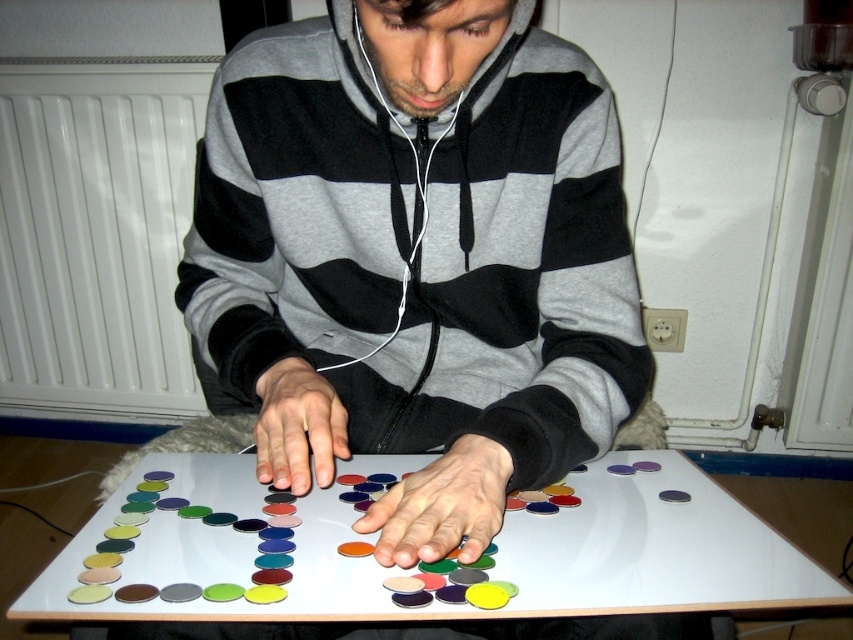
Question: Can you confirm if white glossy table at center is smaller than white matte radiator at left?

Choices:
 (A) yes
 (B) no

Answer: (A)

Question: Which of the following is the closest to the observer?

Choices:
 (A) matte plastic hands at center
 (B) matte plastic coins at center
 (C) matte plastic hand at center

Answer: (A)

Question: Is white glossy table at center smaller than matte plastic hand at center?

Choices:
 (A) yes
 (B) no

Answer: (B)

Question: Can you confirm if white glossy table at center is positioned above white matte radiator at left?

Choices:
 (A) yes
 (B) no

Answer: (B)

Question: Considering the real-world distances, which object is closest to the white glossy table at center?

Choices:
 (A) matte plastic hand at center
 (B) matte plastic coins at center

Answer: (B)

Question: Which object is farther from the camera taking this photo?

Choices:
 (A) matte plastic coins at center
 (B) white glossy table at center

Answer: (A)